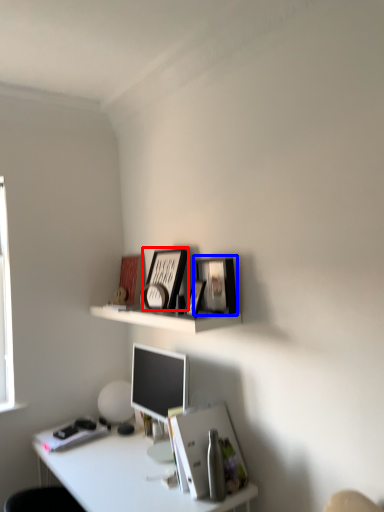
Question: Which object appears farthest to the camera in this image, picture frame (highlighted by a red box) or picture frame (highlighted by a blue box)?

Choices:
 (A) picture frame
 (B) picture frame

Answer: (A)